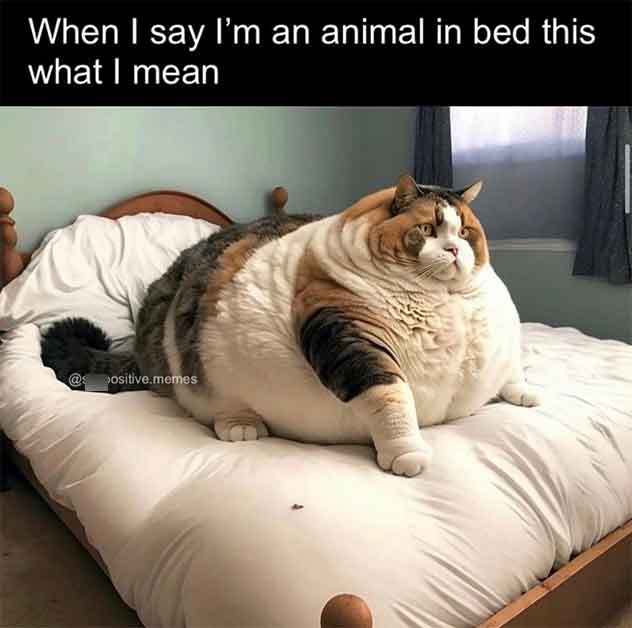
Identify the location of headboard. The width and height of the screenshot is (632, 628). (7, 257), (26, 252), (162, 197), (279, 192).